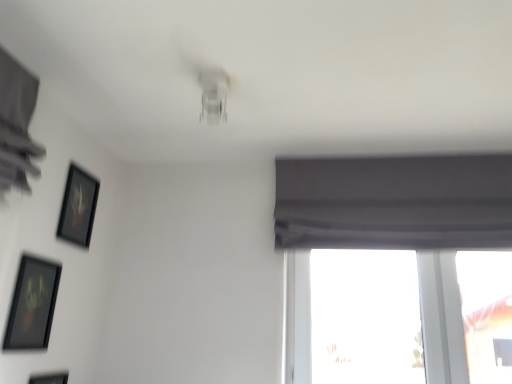
Question: Considering the relative positions of transparent glass window at lower right and black matte picture frame at upper left, the 1th picture frame from the top, in the image provided, is transparent glass window at lower right to the right of black matte picture frame at upper left, the 1th picture frame from the top, from the viewer's perspective?

Choices:
 (A) yes
 (B) no

Answer: (A)

Question: Does transparent glass window at lower right touch black matte picture frame at upper left, the 1th picture frame from the top?

Choices:
 (A) yes
 (B) no

Answer: (B)

Question: Does transparent glass window at lower right have a greater width compared to black matte picture frame at upper left, which is the third picture frame from bottom to top?

Choices:
 (A) yes
 (B) no

Answer: (A)

Question: Is transparent glass window at lower right taller than black matte picture frame at upper left, which is the third picture frame from bottom to top?

Choices:
 (A) no
 (B) yes

Answer: (B)

Question: Is there a large distance between transparent glass window at lower right and black matte picture frame at upper left, which is the third picture frame from bottom to top?

Choices:
 (A) no
 (B) yes

Answer: (B)

Question: Is transparent glass window at lower right positioned behind black matte picture frame at upper left, the 1th picture frame from the top?

Choices:
 (A) no
 (B) yes

Answer: (B)

Question: Is matte black picture frame at lower left, which ranks as the first picture frame in bottom-to-top order, taller than black matte picture frame at upper left, the 1th picture frame from the top?

Choices:
 (A) no
 (B) yes

Answer: (B)

Question: Is matte black picture frame at lower left, which ranks as the 3th picture frame in top-to-bottom order, not close to black matte picture frame at upper left, which is the third picture frame from bottom to top?

Choices:
 (A) yes
 (B) no

Answer: (B)

Question: From the image's perspective, does matte black picture frame at lower left, which ranks as the 3th picture frame in top-to-bottom order, appear higher than black matte picture frame at upper left, which is the third picture frame from bottom to top?

Choices:
 (A) no
 (B) yes

Answer: (A)

Question: Is matte black picture frame at lower left, which ranks as the first picture frame in bottom-to-top order, thinner than black matte picture frame at upper left, which is the third picture frame from bottom to top?

Choices:
 (A) yes
 (B) no

Answer: (A)

Question: From a real-world perspective, is matte black picture frame at lower left, which ranks as the first picture frame in bottom-to-top order, physically above black matte picture frame at upper left, the 1th picture frame from the top?

Choices:
 (A) no
 (B) yes

Answer: (A)

Question: Is the position of matte black picture frame at lower left, which ranks as the 3th picture frame in top-to-bottom order, less distant than that of black matte picture frame at upper left, which is the third picture frame from bottom to top?

Choices:
 (A) no
 (B) yes

Answer: (B)

Question: Is matte black picture frame at lower left, which is counted as the second picture frame, starting from the top, not inside transparent glass window at lower right?

Choices:
 (A) no
 (B) yes

Answer: (B)